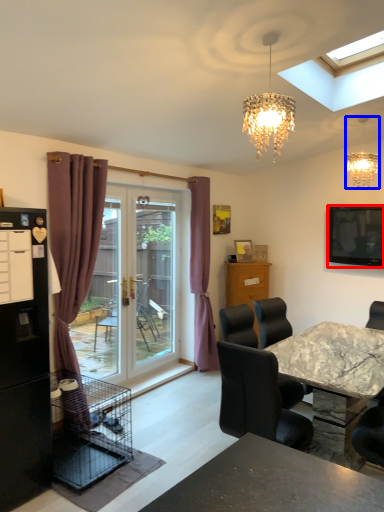
Question: Which of the following is the farthest to the observer, television (highlighted by a red box) or lamp (highlighted by a blue box)?

Choices:
 (A) television
 (B) lamp

Answer: (A)